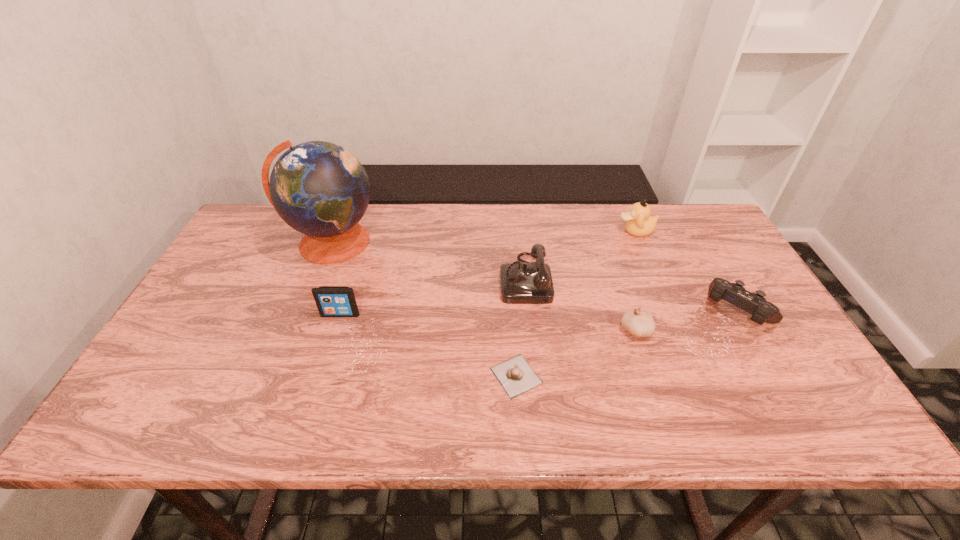
In order to click on globe that is at the far edge in this screenshot , I will do `click(320, 189)`.

Identify the location of duckling at the far edge. (639, 222).

The height and width of the screenshot is (540, 960). What are the coordinates of `object that is at the near edge` in the screenshot? It's located at (515, 375).

You are a GUI agent. You are given a task and a screenshot of the screen. Output one action in this format:
    pyautogui.click(x=<x>, y=<y>)
    Task: Click on the object that is at the left edge
    Image resolution: width=960 pixels, height=540 pixels.
    Given the screenshot: What is the action you would take?
    pyautogui.click(x=320, y=189)

This screenshot has height=540, width=960. What are the coordinates of `object located at the right edge` in the screenshot? It's located at (754, 303).

Find the location of a particular element. object at the far left corner is located at coordinates (320, 189).

The height and width of the screenshot is (540, 960). In the image, there is a desktop. Find the location of `vacant space at the far edge`. vacant space at the far edge is located at coordinates (422, 204).

The width and height of the screenshot is (960, 540). In order to click on free space at the near edge of the desktop in this screenshot , I will do `click(277, 400)`.

Image resolution: width=960 pixels, height=540 pixels. I want to click on free space at the left edge, so click(x=174, y=362).

Find the location of `vacant space at the right edge of the desktop`. vacant space at the right edge of the desktop is located at coordinates (779, 335).